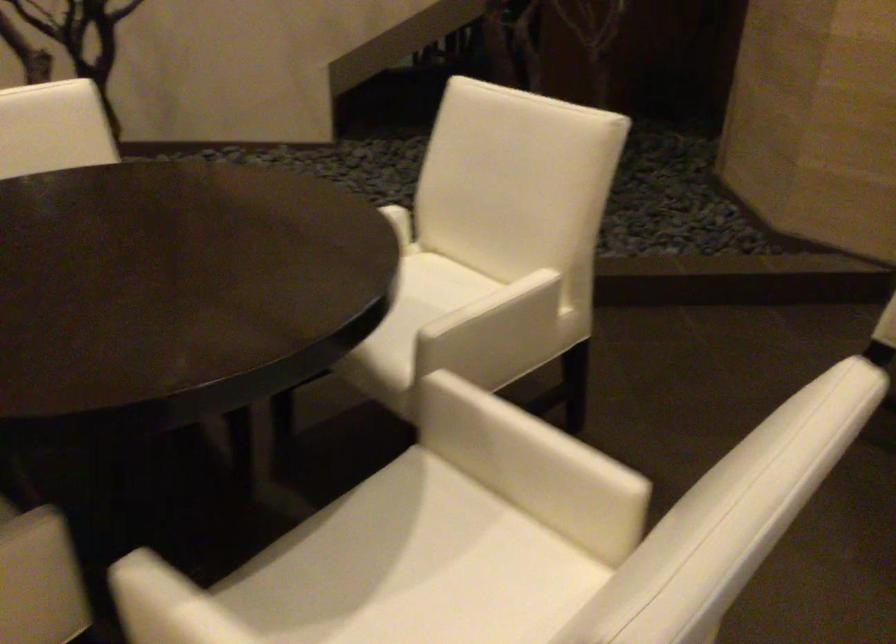
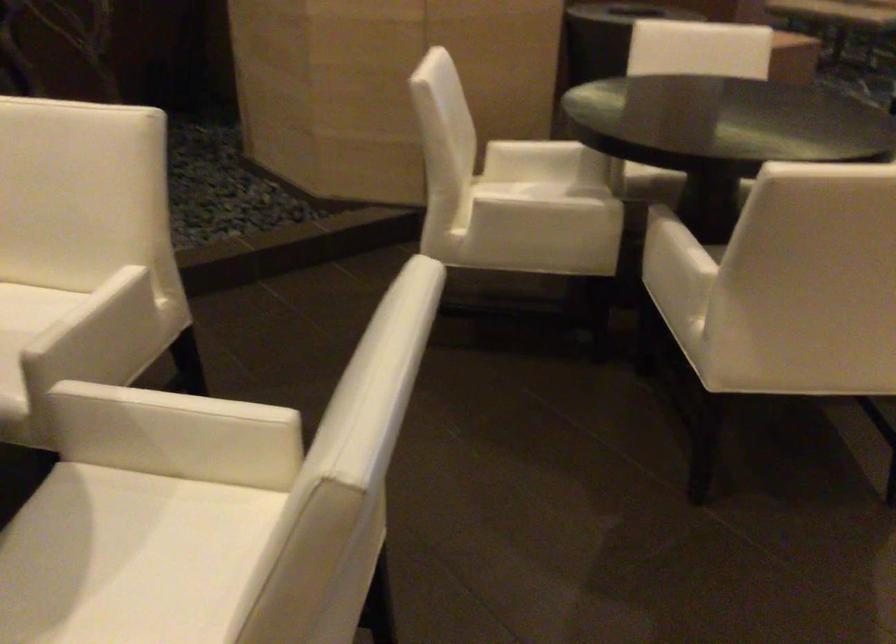
Where in the second image is the point corresponding to pixel 444 285 from the first image?

(24, 308)